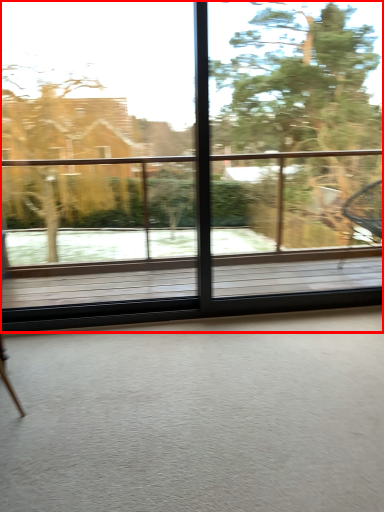
Question: From the image's perspective, where is window (annotated by the red box) located in relation to tree in the image?

Choices:
 (A) below
 (B) above

Answer: (A)